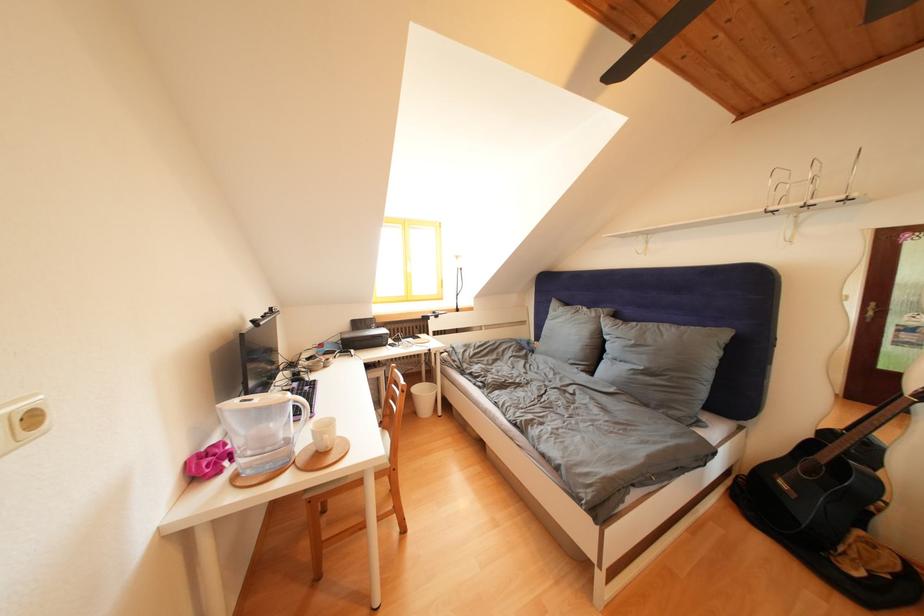
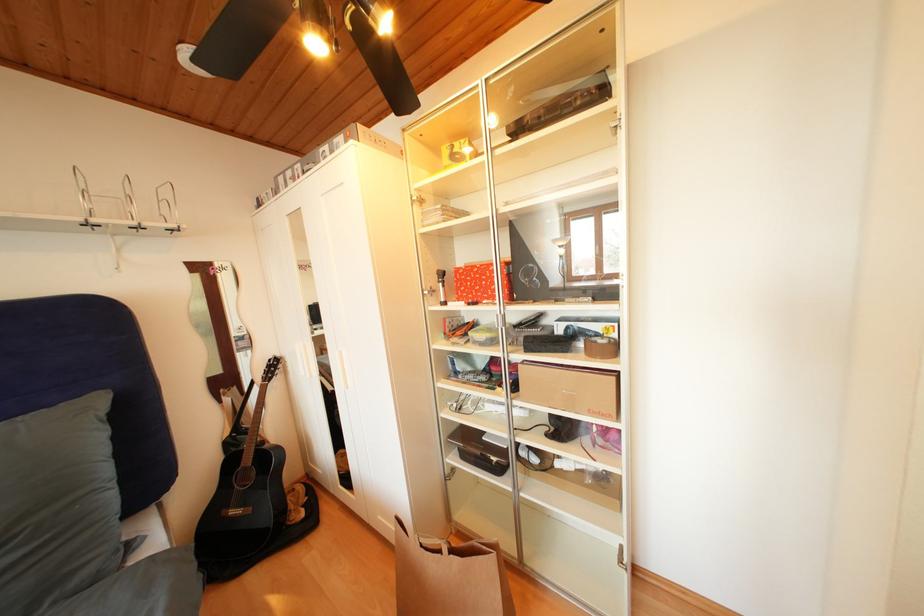
Question: How did the camera likely rotate?

Choices:
 (A) Left
 (B) Right
 (C) Up
 (D) Down

Answer: (B)